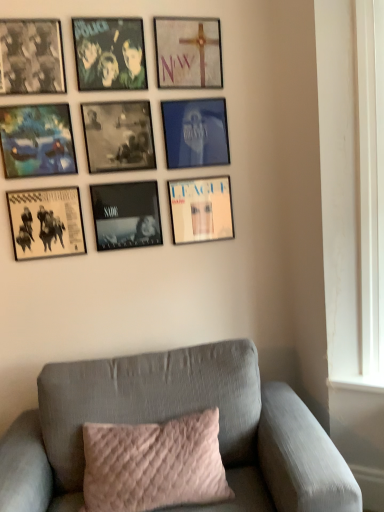
In order to click on matte black album cover at lower left, the first picture frame when ordered from bottom to top in this screenshot , I will do `click(46, 223)`.

What is the approximate width of matte black album cover at lower left, the first picture frame when ordered from bottom to top?

The width of matte black album cover at lower left, the first picture frame when ordered from bottom to top, is 1.22 inches.

Image resolution: width=384 pixels, height=512 pixels. In order to click on blue glossy picture frame at upper center, which is counted as the 4th picture frame, starting from the top in this screenshot , I will do `click(195, 133)`.

The image size is (384, 512). I want to click on pink quilted pillow at center, so click(154, 464).

Image resolution: width=384 pixels, height=512 pixels. Describe the element at coordinates (188, 52) in the screenshot. I see `matte white cross at upper center, acting as the 9th picture frame starting from the bottom` at that location.

How much space does matte black picture frame at upper left, arranged as the third picture frame when viewed from the top, occupy horizontally?

It is 3.10 centimeters.

The image size is (384, 512). In order to click on matte black picture frame at upper left, the seventh picture frame positioned from the bottom in this screenshot , I will do `click(31, 56)`.

The width and height of the screenshot is (384, 512). Identify the location of matte black album cover at lower left, the first picture frame when ordered from bottom to top. (46, 223).

Considering the sizes of matte black album cover at lower left, the first picture frame when ordered from bottom to top, and matte white album cover at lower right, arranged as the 3th picture frame when ordered from the bottom, in the image, is matte black album cover at lower left, the first picture frame when ordered from bottom to top, taller or shorter than matte white album cover at lower right, arranged as the 3th picture frame when ordered from the bottom,?

Clearly, matte black album cover at lower left, the first picture frame when ordered from bottom to top, is shorter compared to matte white album cover at lower right, arranged as the 3th picture frame when ordered from the bottom.

Is matte black album cover at lower left, marked as the ninth picture frame in a top-to-bottom arrangement, in front of or behind matte white album cover at lower right, the seventh picture frame positioned from the top, in the image?

Clearly, matte black album cover at lower left, marked as the ninth picture frame in a top-to-bottom arrangement, is in front of matte white album cover at lower right, the seventh picture frame positioned from the top.

Locate an element on the screen. the 5th picture frame in front of the matte white album cover at lower right, the seventh picture frame positioned from the top, starting your count from the anchor is located at coordinates (46, 223).

From the image's perspective, who appears lower, matte black album cover at lower left, the first picture frame when ordered from bottom to top, or matte white album cover at lower right, the seventh picture frame positioned from the top?

From the image's view, matte black album cover at lower left, the first picture frame when ordered from bottom to top, is below.

Does pink quilted pillow at center have a lesser width compared to matte black album cover at lower left, the first picture frame when ordered from bottom to top?

No, pink quilted pillow at center is not thinner than matte black album cover at lower left, the first picture frame when ordered from bottom to top.

From the image's perspective, is pink quilted pillow at center located above or below matte black album cover at lower left, marked as the ninth picture frame in a top-to-bottom arrangement?

pink quilted pillow at center is situated lower than matte black album cover at lower left, marked as the ninth picture frame in a top-to-bottom arrangement, in the image.

Is pink quilted pillow at center positioned far away from matte black album cover at lower left, marked as the ninth picture frame in a top-to-bottom arrangement?

That's not correct — pink quilted pillow at center is a little close to matte black album cover at lower left, marked as the ninth picture frame in a top-to-bottom arrangement.

How many degrees apart are the facing directions of pink quilted pillow at center and matte black album cover at lower left, the first picture frame when ordered from bottom to top?

The angular difference between pink quilted pillow at center and matte black album cover at lower left, the first picture frame when ordered from bottom to top, is 5.73 degrees.

Which is behind, point (325, 504) or point (25, 125)?

Positioned behind is point (25, 125).

Does gray fabric couch at lower center have a smaller size compared to matte blue painting at upper left, which is the fourth picture frame in bottom-to-top order?

No.

Which object is closer to the camera, gray fabric couch at lower center or matte blue painting at upper left, the 6th picture frame when ordered from top to bottom?

gray fabric couch at lower center is in front.

Is gray fabric couch at lower center situated inside matte blue painting at upper left, which is the fourth picture frame in bottom-to-top order, or outside?

gray fabric couch at lower center is not inside matte blue painting at upper left, which is the fourth picture frame in bottom-to-top order, it's outside.

Which is farther, (30, 487) or (98, 232)?

Point (98, 232)

Is gray fabric couch at lower center to the left or to the right of black matte picture frame at center, which is counted as the second picture frame, starting from the bottom, in the image?

Based on their positions, gray fabric couch at lower center is located to the right of black matte picture frame at center, which is counted as the second picture frame, starting from the bottom.

Consider the image. What's the angular difference between gray fabric couch at lower center and black matte picture frame at center, arranged as the 8th picture frame when viewed from the top,'s facing directions?

The angle between the facing direction of gray fabric couch at lower center and the facing direction of black matte picture frame at center, arranged as the 8th picture frame when viewed from the top, is 5.73 degrees.

There is a gray fabric couch at lower center. Where is `the 2nd picture frame above it (from the image's perspective)`? the 2nd picture frame above it (from the image's perspective) is located at coordinates (126, 215).

Between blue glossy picture frame at upper center, marked as the 6th picture frame in a bottom-to-top arrangement, and matte blue painting at upper left, which is the fourth picture frame in bottom-to-top order, which one has more height?

Standing taller between the two is matte blue painting at upper left, which is the fourth picture frame in bottom-to-top order.

Between blue glossy picture frame at upper center, marked as the 6th picture frame in a bottom-to-top arrangement, and matte blue painting at upper left, which is the fourth picture frame in bottom-to-top order, which one has larger width?

With larger width is matte blue painting at upper left, which is the fourth picture frame in bottom-to-top order.

How much distance is there between blue glossy picture frame at upper center, marked as the 6th picture frame in a bottom-to-top arrangement, and matte blue painting at upper left, the 6th picture frame when ordered from top to bottom?

23.91 inches.

Is blue glossy picture frame at upper center, which is counted as the 4th picture frame, starting from the top, completely or partially outside of matte blue painting at upper left, which is the fourth picture frame in bottom-to-top order?

Yes, blue glossy picture frame at upper center, which is counted as the 4th picture frame, starting from the top, is outside of matte blue painting at upper left, which is the fourth picture frame in bottom-to-top order.

Considering the sizes of objects gray fabric couch at lower center and blue glossy picture frame at upper center, which is counted as the 4th picture frame, starting from the top, in the image provided, who is taller, gray fabric couch at lower center or blue glossy picture frame at upper center, which is counted as the 4th picture frame, starting from the top,?

Standing taller between the two is gray fabric couch at lower center.

From a real-world perspective, who is located lower, gray fabric couch at lower center or blue glossy picture frame at upper center, which is counted as the 4th picture frame, starting from the top?

gray fabric couch at lower center, from a real-world perspective.

Is point (214, 374) positioned behind point (187, 117)?

No, it is in front of (187, 117).

What's the angular difference between matte white cross at upper center, the 1th picture frame viewed from the top, and pink quilted pillow at center's facing directions?

The facing directions of matte white cross at upper center, the 1th picture frame viewed from the top, and pink quilted pillow at center are 5.73 degrees apart.

Between matte white cross at upper center, acting as the 9th picture frame starting from the bottom, and pink quilted pillow at center, which one is positioned in front?

pink quilted pillow at center is more forward.

Locate an element on the screen. The image size is (384, 512). the 8th picture frame above the pink quilted pillow at center (from a real-world perspective) is located at coordinates click(x=188, y=52).

Consider the image. Could you measure the distance between matte white cross at upper center, the 1th picture frame viewed from the top, and pink quilted pillow at center?

matte white cross at upper center, the 1th picture frame viewed from the top, and pink quilted pillow at center are 1.69 meters apart.

You are a GUI agent. You are given a task and a screenshot of the screen. Output one action in this format:
    pyautogui.click(x=<x>, y=<y>)
    Task: Click on the 5th picture frame behind when counting from the matte black album cover at lower left, the first picture frame when ordered from bottom to top
    The image size is (384, 512).
    Given the screenshot: What is the action you would take?
    pyautogui.click(x=201, y=209)

Which picture frame is the 4th one when counting from the left side of the pink quilted pillow at center? Please provide its 2D coordinates.

[(46, 223)]

Considering their positions, is matte black picture frame at upper left, arranged as the third picture frame when viewed from the top, positioned further to matte black album cover at upper left, which is the second picture frame from top to bottom, than gray fabric couch at lower center?

Based on the image, gray fabric couch at lower center appears to be further to matte black album cover at upper left, which is the second picture frame from top to bottom.

When comparing their distances from gray fabric couch at lower center, does matte blue painting at upper left, the 6th picture frame when ordered from top to bottom, or matte black album cover at lower left, the first picture frame when ordered from bottom to top, seem closer?

The object closer to gray fabric couch at lower center is matte black album cover at lower left, the first picture frame when ordered from bottom to top.

Estimate the real-world distances between objects in this image. Which object is further from matte black album cover at lower left, the first picture frame when ordered from bottom to top, pink quilted pillow at center or matte black picture frame at upper left, arranged as the third picture frame when viewed from the top?

Among the two, pink quilted pillow at center is located further to matte black album cover at lower left, the first picture frame when ordered from bottom to top.

When comparing their distances from pink quilted pillow at center, does matte blue painting at upper left, which is the fourth picture frame in bottom-to-top order, or matte black picture frame at upper left, the seventh picture frame positioned from the bottom, seem further?

matte black picture frame at upper left, the seventh picture frame positioned from the bottom.

Which object lies nearer to the anchor point gray fabric couch at lower center, matte blue painting at upper left, the 6th picture frame when ordered from top to bottom, or blue glossy picture frame at upper center, marked as the 6th picture frame in a bottom-to-top arrangement?

The object closer to gray fabric couch at lower center is blue glossy picture frame at upper center, marked as the 6th picture frame in a bottom-to-top arrangement.

Considering their positions, is matte black picture frame at upper left, arranged as the third picture frame when viewed from the top, positioned closer to matte blue painting at upper left, the 6th picture frame when ordered from top to bottom, than gray fabric couch at lower center?

matte black picture frame at upper left, arranged as the third picture frame when viewed from the top, lies closer to matte blue painting at upper left, the 6th picture frame when ordered from top to bottom, than the other object.

Looking at this image, looking at the image, which one is located further to black matte picture frame at center, which is counted as the second picture frame, starting from the bottom, black matte picture frame at center, the fifth picture frame from the bottom, or matte black picture frame at upper left, the seventh picture frame positioned from the bottom?

Based on the image, matte black picture frame at upper left, the seventh picture frame positioned from the bottom, appears to be further to black matte picture frame at center, which is counted as the second picture frame, starting from the bottom.

Considering their positions, is black matte picture frame at center, which is counted as the second picture frame, starting from the bottom, positioned closer to pink quilted pillow at center than matte black album cover at lower left, the first picture frame when ordered from bottom to top?

black matte picture frame at center, which is counted as the second picture frame, starting from the bottom, is positioned closer to the anchor pink quilted pillow at center.

Identify the location of pillow between black matte picture frame at center, which is counted as the second picture frame, starting from the bottom, and gray fabric couch at lower center, in the vertical direction. The image size is (384, 512). (154, 464).

The height and width of the screenshot is (512, 384). Identify the location of pillow between matte white cross at upper center, the 1th picture frame viewed from the top, and gray fabric couch at lower center in the up-down direction. (154, 464).

You are a GUI agent. You are given a task and a screenshot of the screen. Output one action in this format:
    pyautogui.click(x=<x>, y=<y>)
    Task: Click on the picture frame between black matte picture frame at center, arranged as the 8th picture frame when viewed from the top, and pink quilted pillow at center from top to bottom
    
    Given the screenshot: What is the action you would take?
    pyautogui.click(x=46, y=223)

Where is `pillow between matte black album cover at lower left, marked as the ninth picture frame in a top-to-bottom arrangement, and gray fabric couch at lower center from top to bottom`? This screenshot has height=512, width=384. pillow between matte black album cover at lower left, marked as the ninth picture frame in a top-to-bottom arrangement, and gray fabric couch at lower center from top to bottom is located at coordinates (154, 464).